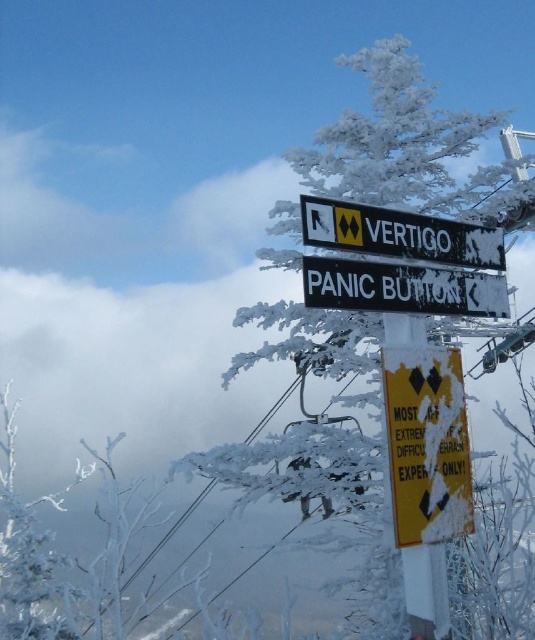
Question: Which point is farther from the camera taking this photo?

Choices:
 (A) (446, 259)
 (B) (491, 304)

Answer: (B)

Question: Does frosted snow-covered tree at upper center appear on the right side of black plastic sign at upper center?

Choices:
 (A) yes
 (B) no

Answer: (A)

Question: Does frosted snow-covered tree at upper center come behind black plastic sign at center?

Choices:
 (A) no
 (B) yes

Answer: (B)

Question: In this image, where is black plastic sign at center located relative to black plastic sign at upper center?

Choices:
 (A) left
 (B) right

Answer: (B)

Question: Which of the following is the closest to the observer?

Choices:
 (A) (431, 276)
 (B) (392, 241)
 (C) (364, 364)

Answer: (B)

Question: Which point appears farthest from the camera in this image?

Choices:
 (A) (461, 314)
 (B) (434, 381)
 (C) (308, 173)
 (D) (339, 205)

Answer: (C)